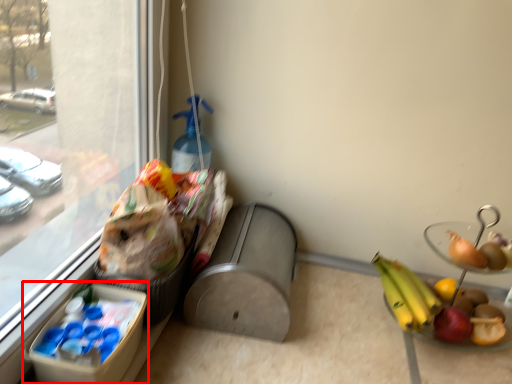
Question: Considering the relative positions of lunch box (annotated by the red box) and basket in the image provided, where is lunch box (annotated by the red box) located with respect to the staircase?

Choices:
 (A) right
 (B) left

Answer: (B)